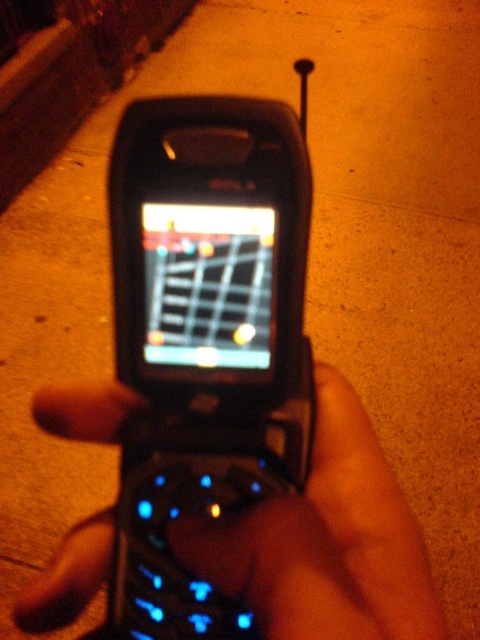
You are a photographer trying to take a clear photo of the black matte phone at center and the concrete at upper left. Which object will appear larger in the photo?

The black matte phone at center will appear larger in the photo because it is in front of the concrete at upper left, making it closer to the camera.

You are a photographer setting up a tripod to take a closeup of the black matte phone at center and the concrete at upper left. Which object should you focus on first if you want to ensure both are in focus?

The concrete at upper left is larger than the black matte phone at center, so focusing on the larger object first may help achieve better focus for both.

You are holding a flip phone from the early 2000s. The point on the phone at coordinates (260,545) is where you want to press a button. If your finger is 0.5 inches wide, can you press that point without touching any other part of the phone?

The point at (260,545) is 10.75 inches away from the viewer. Since your finger is only 0.5 inches wide, you can press the point without touching other parts of the phone.